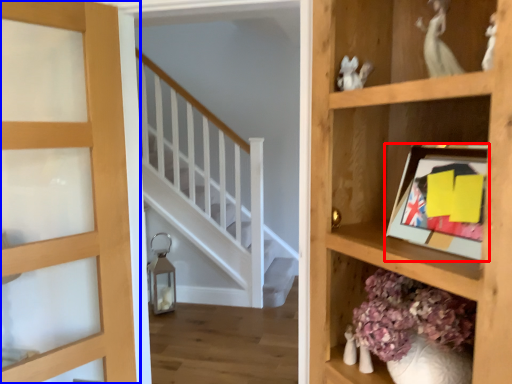
Question: Which of the following is the closest to the observer, picture frame (highlighted by a red box) or door (highlighted by a blue box)?

Choices:
 (A) picture frame
 (B) door

Answer: (A)